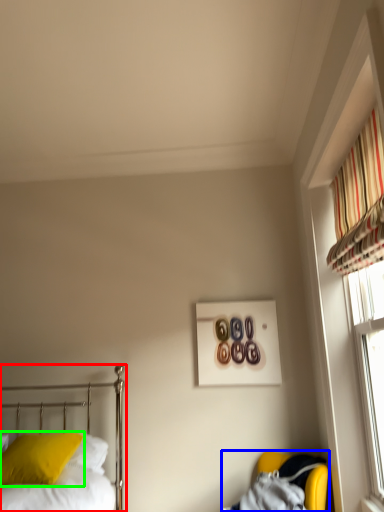
Question: Which is nearer to the bed (highlighted by a red box)? armchair (highlighted by a blue box) or pillow (highlighted by a green box).

Choices:
 (A) armchair
 (B) pillow

Answer: (B)